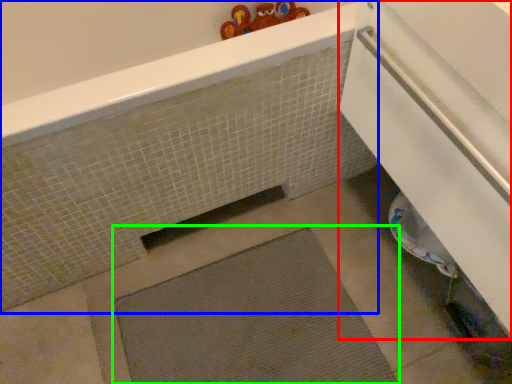
Question: Considering the real-world distances, which object is farthest from screen door (highlighted by a red box)? bath (highlighted by a blue box) or bath mat (highlighted by a green box)?

Choices:
 (A) bath
 (B) bath mat

Answer: (B)